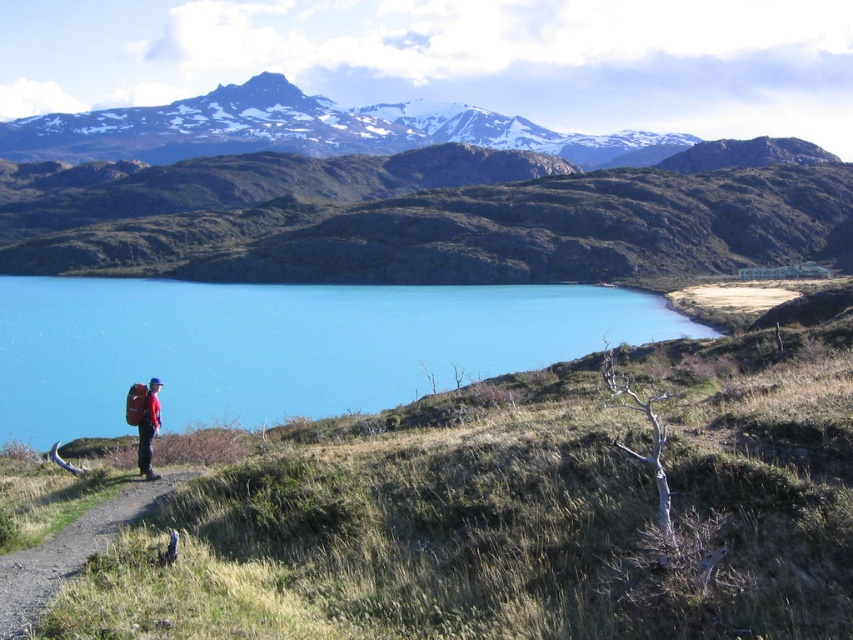
Question: Does blue glassy water at center have a smaller size compared to dirt path at lower left?

Choices:
 (A) no
 (B) yes

Answer: (A)

Question: Can you confirm if blue glassy water at center is positioned to the left of dirt path at lower left?

Choices:
 (A) no
 (B) yes

Answer: (B)

Question: Which object is closer to the camera taking this photo?

Choices:
 (A) matte red backpack at lower left
 (B) dirt path at lower left
 (C) blue glassy water at center

Answer: (B)

Question: Does blue glassy water at center have a larger size compared to matte red backpack at lower left?

Choices:
 (A) yes
 (B) no

Answer: (A)

Question: Which is farther from the dirt path at lower left?

Choices:
 (A) blue glassy water at center
 (B) matte red backpack at lower left

Answer: (A)

Question: Based on their relative distances, which object is nearer to the blue glassy water at center?

Choices:
 (A) dirt path at lower left
 (B) matte red backpack at lower left

Answer: (A)